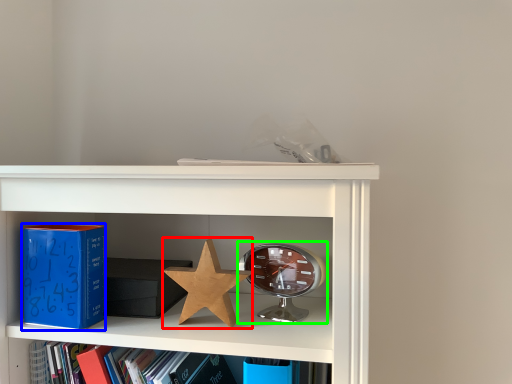
Question: Considering the real-world distances, which object is farthest from star (highlighted by a red box)? paperback book (highlighted by a blue box) or alarm clock (highlighted by a green box)?

Choices:
 (A) paperback book
 (B) alarm clock

Answer: (A)